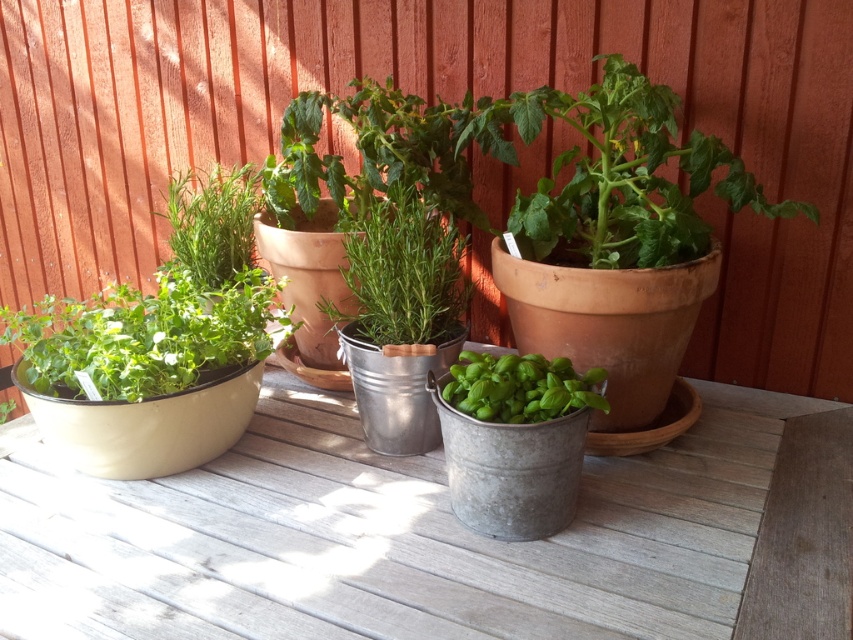
Can you confirm if green matte herb at center is wider than green matte basil at center?

Indeed, green matte herb at center has a greater width compared to green matte basil at center.

Which is in front, point (421, 337) or point (469, 362)?

Point (421, 337) is in front.

The image size is (853, 640). Identify the location of green matte herb at center. (404, 269).

Does green matte herb at center appear on the left side of green matte herb at upper left?

Incorrect, green matte herb at center is not on the left side of green matte herb at upper left.

Who is more forward, (358, 250) or (200, 262)?

Positioned in front is point (358, 250).

Identify the location of green matte herb at center. [404, 269].

Locate an element on the screen. green matte herb at center is located at coordinates click(x=404, y=269).

Between point (190, 308) and point (520, 371), which one is positioned in front?

Point (520, 371) is in front.

Is green matte herb at left taller than green matte basil at center?

Correct, green matte herb at left is much taller as green matte basil at center.

Who is more forward, (149, 342) or (537, 362)?

Point (537, 362) is in front.

Where is `green matte herb at left`? green matte herb at left is located at coordinates (144, 336).